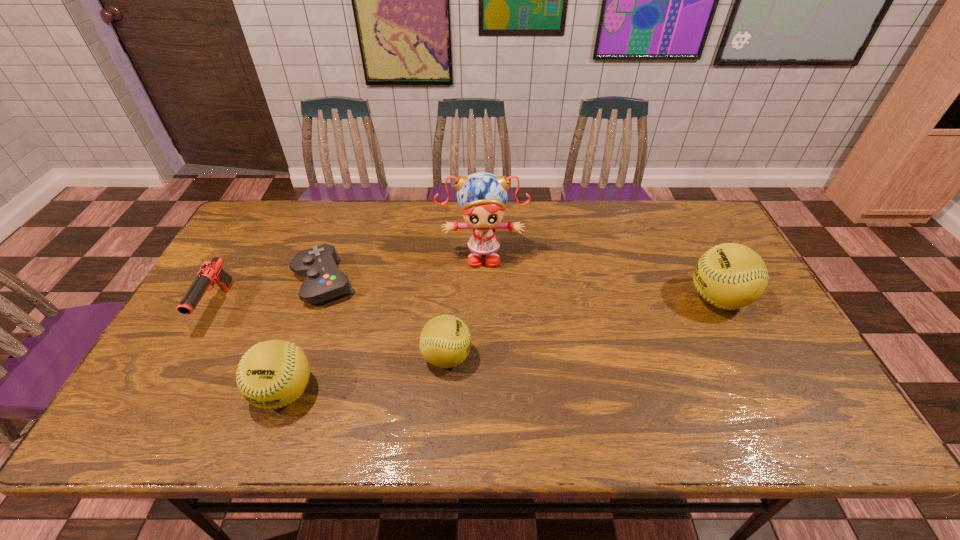
The height and width of the screenshot is (540, 960). I want to click on the fourth shortest object, so click(272, 374).

Find the location of `the second shortest softball`. the second shortest softball is located at coordinates (272, 374).

Image resolution: width=960 pixels, height=540 pixels. In order to click on the second softball from left to right in this screenshot , I will do `click(445, 341)`.

This screenshot has height=540, width=960. I want to click on the farthest softball, so click(x=730, y=276).

Image resolution: width=960 pixels, height=540 pixels. Identify the location of the rightmost object. (730, 276).

Identify the location of doll. (482, 197).

Where is `gun`? The image size is (960, 540). gun is located at coordinates (211, 272).

I want to click on the shortest object, so click(323, 280).

At what (x,y) coordinates should I click in order to perform the action: click on free spot located 0.330m on the logo side of the shortest softball. Please return your answer as a coordinate pair (x, y). Looking at the image, I should click on (603, 356).

What are the coordinates of `free point located on the logo side of the rightmost softball` in the screenshot? It's located at (570, 298).